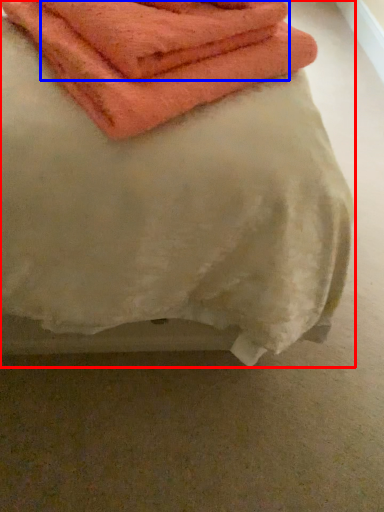
Question: Which of the following is the closest to the observer, towel (highlighted by a red box) or towel (highlighted by a blue box)?

Choices:
 (A) towel
 (B) towel

Answer: (A)